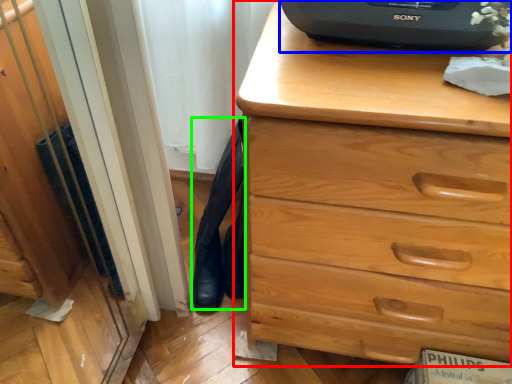
Question: Which is farther away from chest of drawers (highlighted by a red box)? desktop computer (highlighted by a blue box) or tight (highlighted by a green box)?

Choices:
 (A) desktop computer
 (B) tight

Answer: (B)